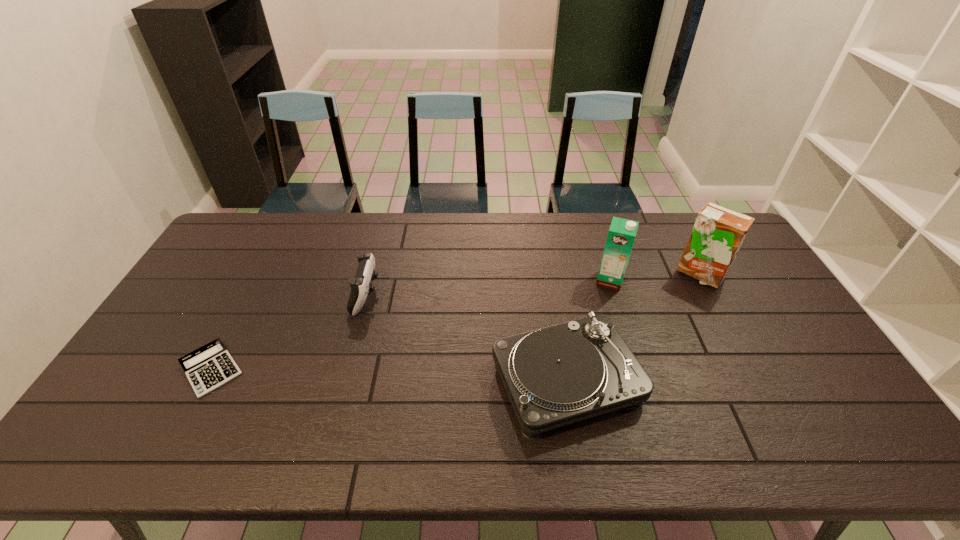
In order to click on free spot located 0.050m on the left of the leftmost object in this screenshot , I will do `click(159, 369)`.

The image size is (960, 540). Find the location of `object located at the near edge`. object located at the near edge is located at coordinates (554, 376).

Identify the location of object that is at the left edge. (210, 366).

Locate an element on the screen. The height and width of the screenshot is (540, 960). object that is at the right edge is located at coordinates (718, 233).

Find the location of a particular element. vacant space at the far edge of the desktop is located at coordinates (671, 213).

The image size is (960, 540). What are the coordinates of `vacant space at the near edge of the desktop` in the screenshot? It's located at (202, 443).

This screenshot has height=540, width=960. I want to click on vacant space at the left edge, so click(x=207, y=263).

I want to click on free space at the right edge of the desktop, so click(825, 379).

Identify the location of vacant space at the far left corner of the desktop. The width and height of the screenshot is (960, 540). (238, 221).

Find the location of a particular element. The image size is (960, 540). vacant region between the leftmost object and the left carton is located at coordinates (411, 325).